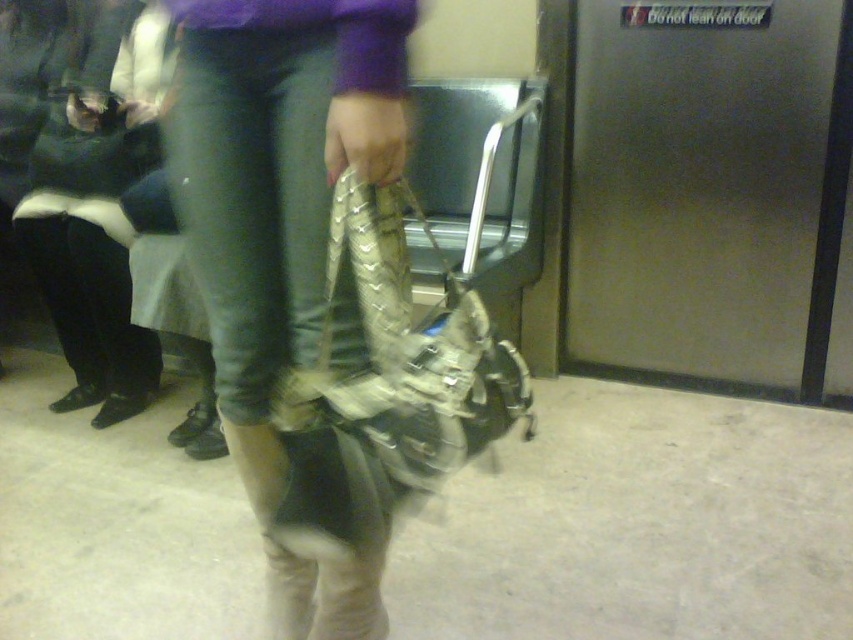
Consider the image. Is the position of leather boots at center less distant than that of leather-like metallic bag at center?

Yes, leather boots at center is closer to the viewer.

Is leather boots at center shorter than leather-like metallic bag at center?

No.

Measure the distance between point (229, 52) and camera.

1.06 meters

This screenshot has width=853, height=640. Identify the location of leather boots at center. (281, 230).